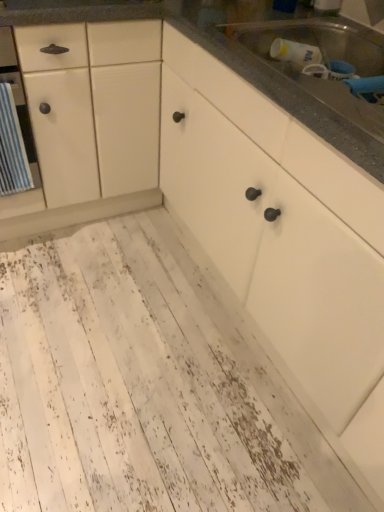
Question: Does metallic stainless steel sink at upper right have a larger size compared to white wood countertop at upper right?

Choices:
 (A) yes
 (B) no

Answer: (B)

Question: Does metallic stainless steel sink at upper right appear on the right side of white wood countertop at upper right?

Choices:
 (A) no
 (B) yes

Answer: (B)

Question: From the image's perspective, would you say metallic stainless steel sink at upper right is shown under white wood countertop at upper right?

Choices:
 (A) yes
 (B) no

Answer: (A)

Question: Does metallic stainless steel sink at upper right come in front of white wood countertop at upper right?

Choices:
 (A) no
 (B) yes

Answer: (B)

Question: From a real-world perspective, is metallic stainless steel sink at upper right physically below white wood countertop at upper right?

Choices:
 (A) no
 (B) yes

Answer: (A)

Question: Considering the relative sizes of metallic stainless steel sink at upper right and white wood countertop at upper right in the image provided, is metallic stainless steel sink at upper right smaller than white wood countertop at upper right?

Choices:
 (A) yes
 (B) no

Answer: (A)

Question: From a real-world perspective, is white distressed wood floor at lower left located higher than metallic stainless steel sink at upper right?

Choices:
 (A) no
 (B) yes

Answer: (A)

Question: Is white distressed wood floor at lower left looking in the opposite direction of metallic stainless steel sink at upper right?

Choices:
 (A) no
 (B) yes

Answer: (A)

Question: Can you confirm if white distressed wood floor at lower left is wider than metallic stainless steel sink at upper right?

Choices:
 (A) no
 (B) yes

Answer: (B)

Question: Is there a large distance between white distressed wood floor at lower left and metallic stainless steel sink at upper right?

Choices:
 (A) no
 (B) yes

Answer: (B)

Question: Is white distressed wood floor at lower left outside of metallic stainless steel sink at upper right?

Choices:
 (A) no
 (B) yes

Answer: (B)

Question: Is white distressed wood floor at lower left to the left of metallic stainless steel sink at upper right from the viewer's perspective?

Choices:
 (A) yes
 (B) no

Answer: (A)

Question: Is metallic stainless steel sink at upper right at the left side of white distressed wood floor at lower left?

Choices:
 (A) yes
 (B) no

Answer: (B)